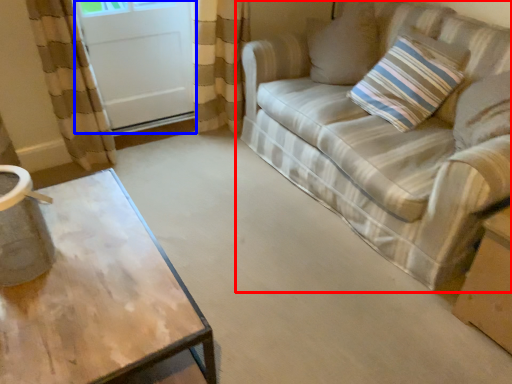
Question: Which point is further to the camera, studio couch (highlighted by a red box) or screen door (highlighted by a blue box)?

Choices:
 (A) studio couch
 (B) screen door

Answer: (B)